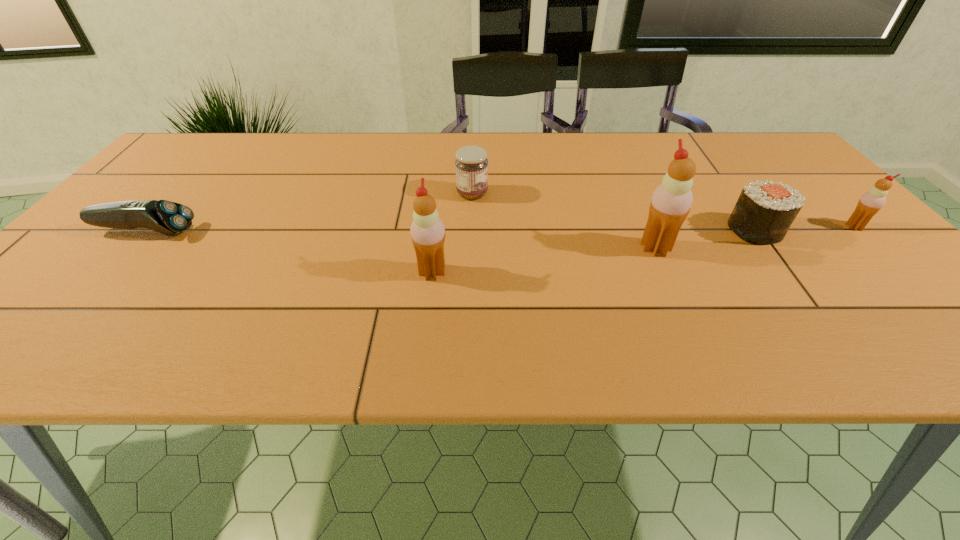
Locate an element on the screen. The width and height of the screenshot is (960, 540). vacant space that is in between the sushi and the shortest icecream is located at coordinates (804, 228).

Identify the location of vacant space that's between the farthest icecream and the nearest object. The image size is (960, 540). (643, 249).

Where is `unoccupied position between the farthest object and the second icecream from left to right`? unoccupied position between the farthest object and the second icecream from left to right is located at coordinates (564, 221).

Choose which object is the second nearest neighbor to the shortest object. Please provide its 2D coordinates. Your answer should be formatted as a tuple, i.e. [(x, y)], where the tuple contains the x and y coordinates of a point satisfying the conditions above.

[(471, 165)]

Identify which object is located as the second nearest to the fifth object from left to right. Please provide its 2D coordinates. Your answer should be formatted as a tuple, i.e. [(x, y)], where the tuple contains the x and y coordinates of a point satisfying the conditions above.

[(871, 202)]

Locate which icecream ranks in proximity to the fourth object from right to left. Please provide its 2D coordinates. Your answer should be formatted as a tuple, i.e. [(x, y)], where the tuple contains the x and y coordinates of a point satisfying the conditions above.

[(427, 230)]

At what (x,y) coordinates should I click in order to perform the action: click on icecream that is the second closest to the farthest object. Please return your answer as a coordinate pair (x, y). Looking at the image, I should click on (670, 204).

At what (x,y) coordinates should I click in order to perform the action: click on vacant position in the image that satisfies the following two spatial constraints: 1. on the front label of the farthest object; 2. on the left side of the sushi. Please return your answer as a coordinate pair (x, y). The height and width of the screenshot is (540, 960). Looking at the image, I should click on (471, 230).

This screenshot has height=540, width=960. In order to click on vacant area in the image that satisfies the following two spatial constraints: 1. at the front with a straw on the rightmost icecream; 2. on the head of the leftmost object in this screenshot , I will do `click(859, 232)`.

At what (x,y) coordinates should I click in order to perform the action: click on free space that satisfies the following two spatial constraints: 1. at the front with a straw on the rightmost icecream; 2. at the front with a straw on the second farthest icecream. Please return your answer as a coordinate pair (x, y). This screenshot has width=960, height=540. Looking at the image, I should click on (876, 248).